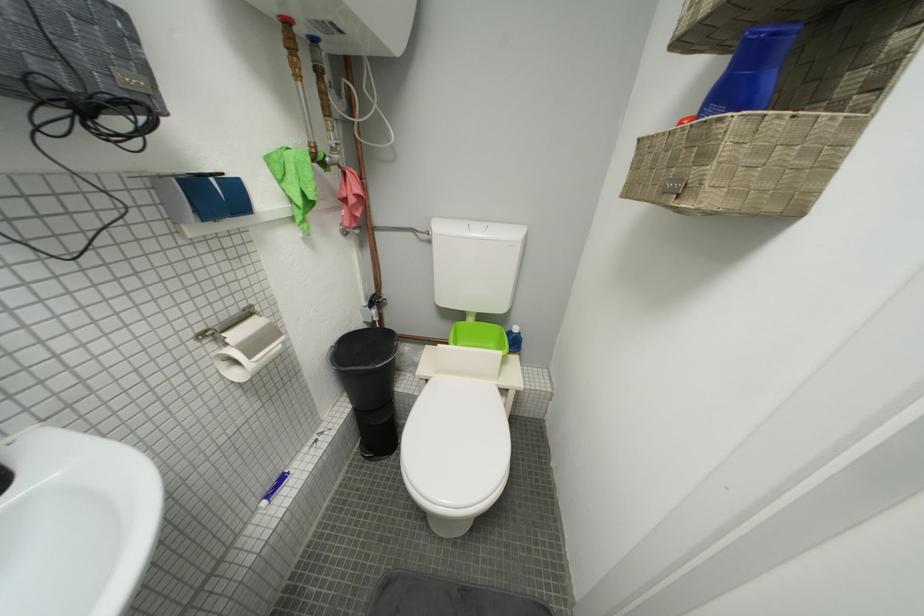
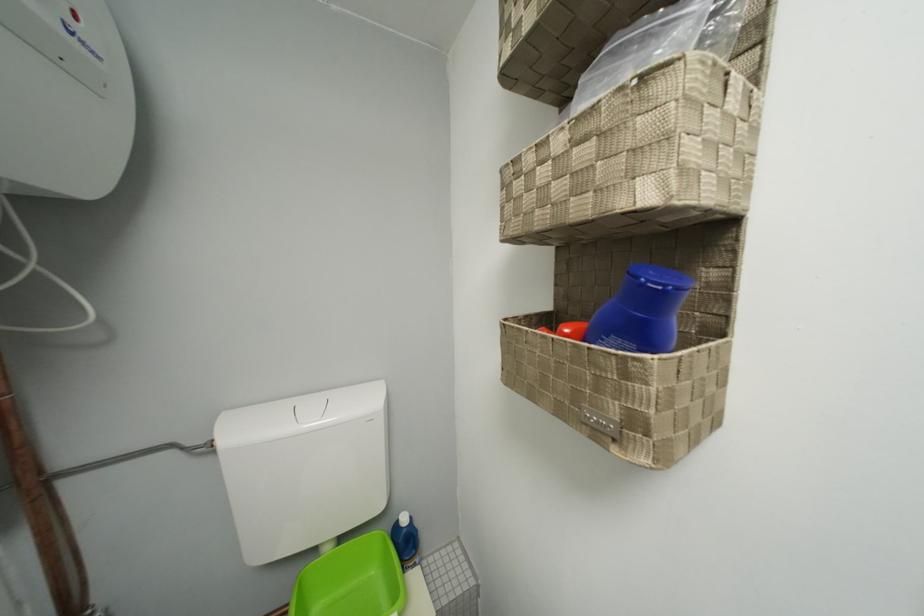
Where in the second image is the point corresponding to point (479, 322) from the first image?

(335, 552)